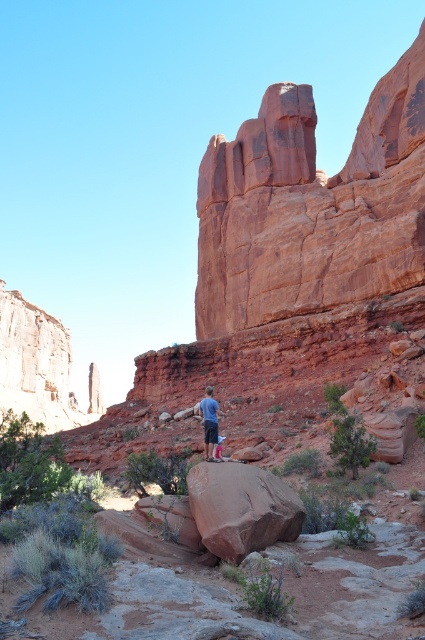
Question: Does rustic sandstone rock formation at upper center have a greater width compared to rustic sandstone boulder at center?

Choices:
 (A) no
 (B) yes

Answer: (B)

Question: Which point is closer to the camera?

Choices:
 (A) rustic sandstone boulder at center
 (B) rustic sandstone rock formation at upper center
 (C) matte blue shirt at center

Answer: (A)

Question: Based on their relative distances, which object is nearer to the matte blue shirt at center?

Choices:
 (A) rustic sandstone boulder at center
 (B) rustic sandstone rock formation at upper center

Answer: (A)

Question: Is the position of rustic sandstone rock formation at upper center more distant than that of matte blue shirt at center?

Choices:
 (A) yes
 (B) no

Answer: (A)

Question: Which object appears farthest from the camera in this image?

Choices:
 (A) rustic sandstone boulder at center
 (B) matte blue shirt at center

Answer: (B)

Question: Where is rustic sandstone boulder at center located in relation to matte blue shirt at center in the image?

Choices:
 (A) below
 (B) above

Answer: (A)